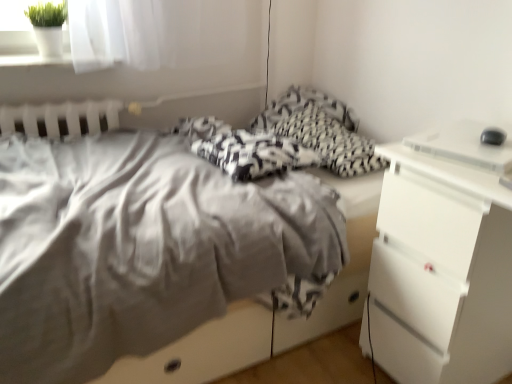
Question: Is white plastic desktop at right in front of or behind white plastic chest of drawers at right in the image?

Choices:
 (A) behind
 (B) front

Answer: (A)

Question: From a real-world perspective, is white plastic desktop at right positioned above or below white plastic chest of drawers at right?

Choices:
 (A) below
 (B) above

Answer: (B)

Question: Based on their relative distances, which object is nearer to the white plastic chest of drawers at right?

Choices:
 (A) white plastic desktop at right
 (B) matte gray bed at center

Answer: (A)

Question: Which object is positioned farthest from the white plastic desktop at right?

Choices:
 (A) matte gray bed at center
 (B) white plastic chest of drawers at right

Answer: (A)